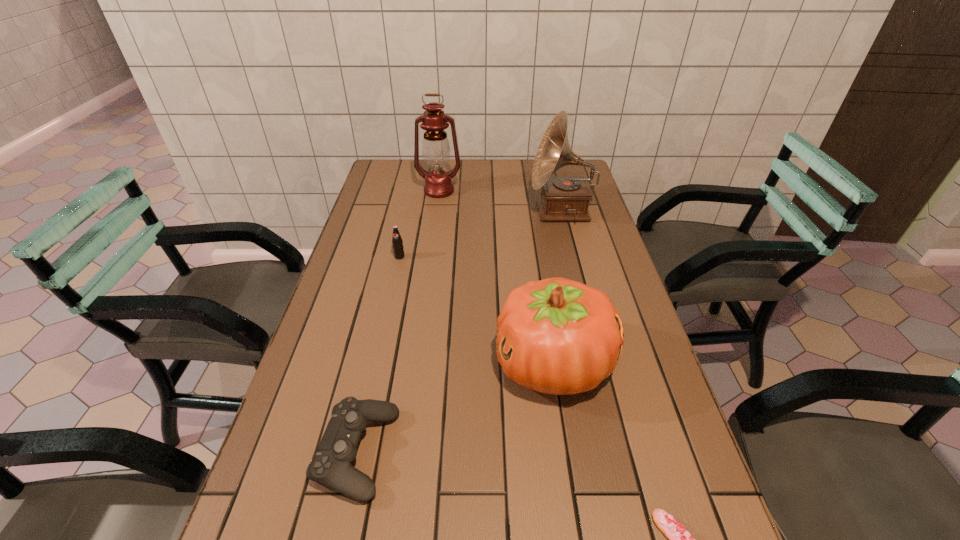
At what (x,y) coordinates should I click in order to perform the action: click on free location located on the side of the pumpkin with the cute face. Please return your answer as a coordinate pair (x, y). The width and height of the screenshot is (960, 540). Looking at the image, I should click on (380, 364).

In order to click on free point located on the side of the pumpkin with the cute face in this screenshot , I will do `click(461, 364)`.

The height and width of the screenshot is (540, 960). Find the location of `free space located on the side of the pumpkin with the cute face`. free space located on the side of the pumpkin with the cute face is located at coordinates (333, 364).

Identify the location of vacant position located 0.200m on the front label of the third shortest object. (389, 307).

What are the coordinates of `vacant point located on the right of the control` in the screenshot? It's located at (487, 454).

This screenshot has height=540, width=960. In order to click on object located at the far edge in this screenshot , I will do `click(435, 149)`.

You are a GUI agent. You are given a task and a screenshot of the screen. Output one action in this format:
    pyautogui.click(x=<x>, y=<y>)
    Task: Click on the pop positioned at the left edge
    The width and height of the screenshot is (960, 540).
    Given the screenshot: What is the action you would take?
    pyautogui.click(x=398, y=249)

What are the coordinates of `control located in the left edge section of the desktop` in the screenshot? It's located at (331, 466).

I want to click on phonograph record present at the right edge, so click(x=563, y=198).

Locate an element on the screen. This screenshot has width=960, height=540. pumpkin that is at the right edge is located at coordinates (557, 336).